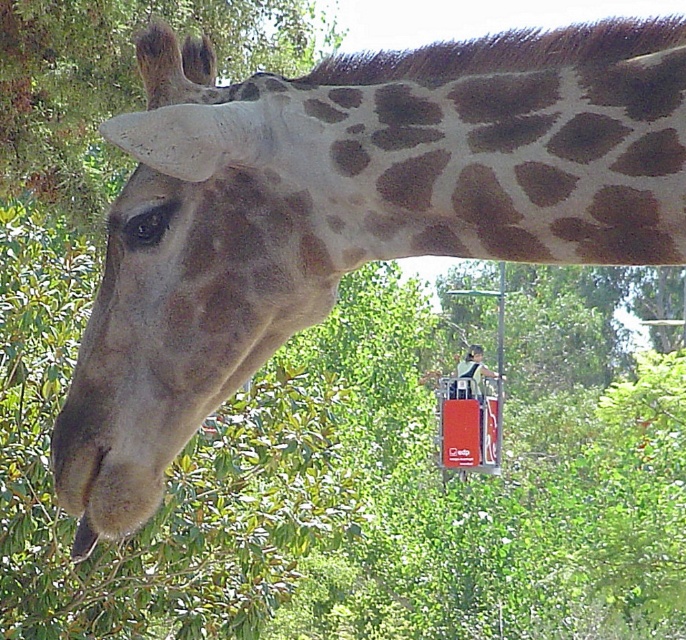
Question: Which point is closer to the camera?

Choices:
 (A) brown spotted skin at center
 (B) smooth brown head at center

Answer: (A)

Question: Can you confirm if brown spotted skin at center is positioned to the right of smooth brown head at center?

Choices:
 (A) no
 (B) yes

Answer: (A)

Question: Is brown spotted skin at center positioned at the back of smooth brown head at center?

Choices:
 (A) yes
 (B) no

Answer: (B)

Question: Among these objects, which one is nearest to the camera?

Choices:
 (A) smooth brown head at center
 (B) brown spotted skin at center

Answer: (B)

Question: Does brown spotted skin at center appear under smooth brown head at center?

Choices:
 (A) no
 (B) yes

Answer: (A)